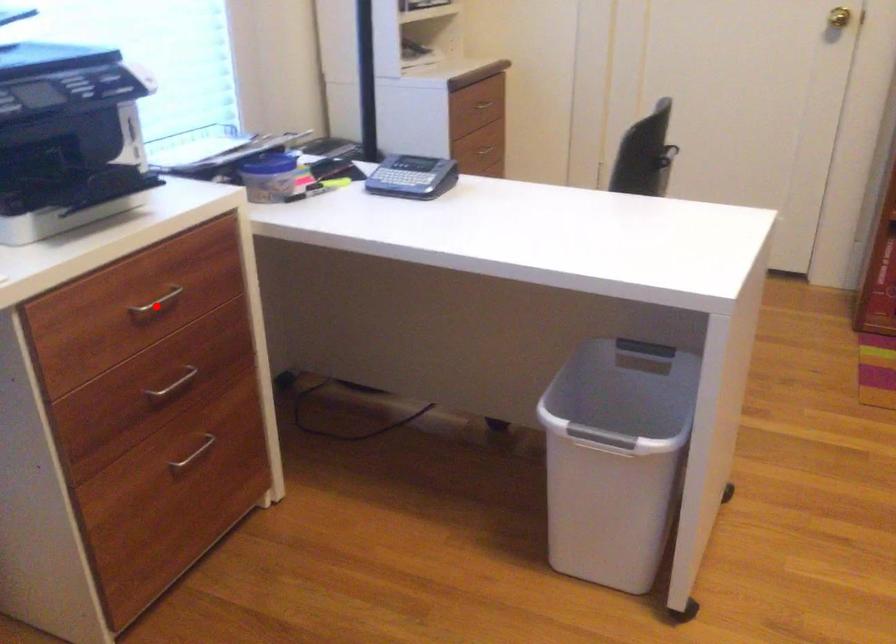
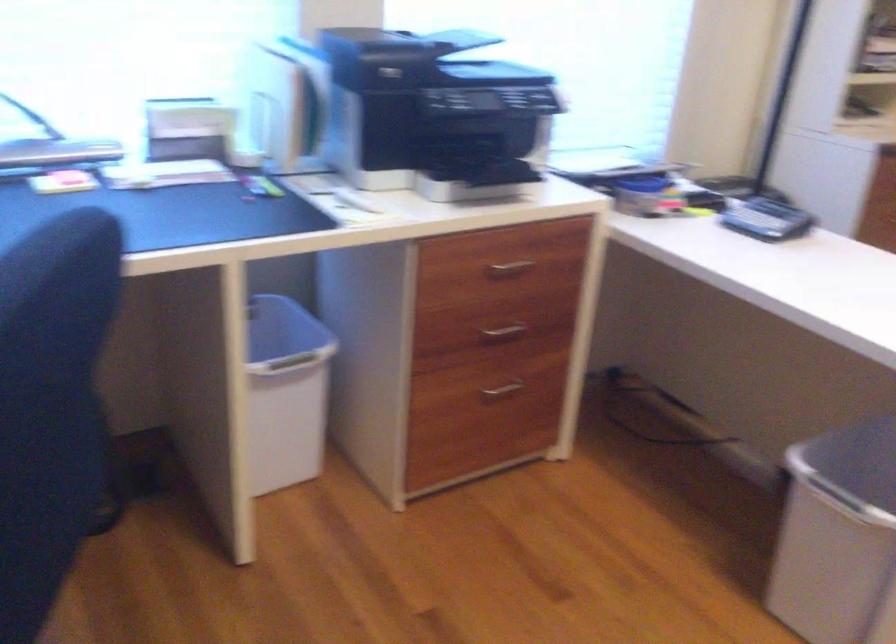
Question: I am providing you with two images of the same scene from different viewpoints. A red point is shown in image1. For the corresponding object point in image2, is it positioned nearer or farther from the camera?

Choices:
 (A) Nearer
 (B) Farther

Answer: (B)